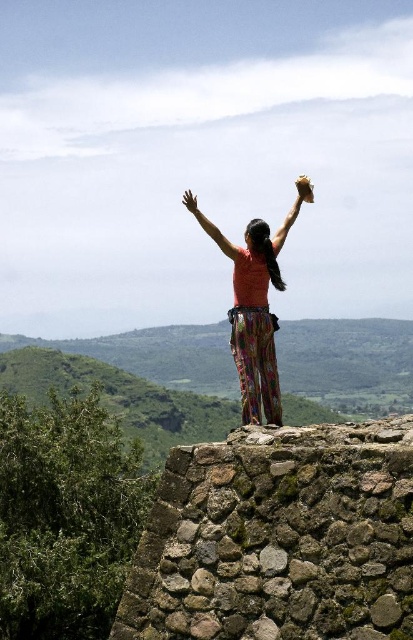
You are standing at the point marked by the coordinate (279, 538) in the image. Which object are you closest to?

You are closest to the rustic stone wall at center, as the point (279, 538) represents its location.

You are a fashion designer observing the person in the image. You need to create a new outfit that matches the existing colors and patterns. Which object should you use as the primary color reference, the matte orange shirt at center or the matte brown glove at upper center?

The matte orange shirt at center has a smaller width than the matte brown glove at upper center, so the primary color reference should be the matte brown glove at upper center because it has a larger presence in the outfit.

You are a photographer aiming to capture the vibrant colors of the scene. You notice the matte orange shirt at center and the matte brown glove at upper center. Which object is closer to the camera, and why?

The matte orange shirt at center is closer to the camera because it is in front of the matte brown glove at upper center, as stated in the description.